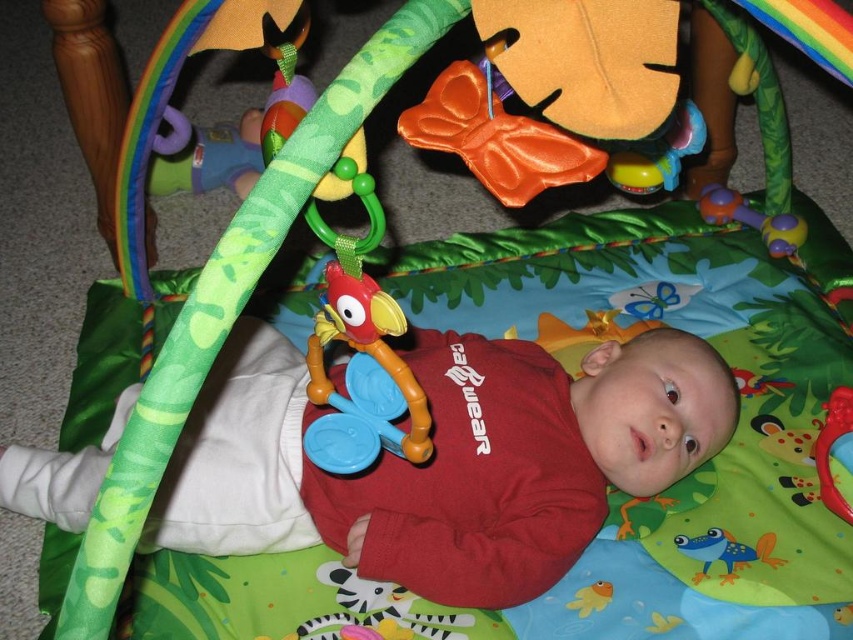
Which is more to the left, red matte baby at center or rubberized plastic bird at center?

From the viewer's perspective, red matte baby at center appears more on the left side.

Which is behind, point (537, 413) or point (322, 356)?

Positioned behind is point (537, 413).

Who is more forward, (294, 362) or (376, 368)?

Point (376, 368)

Where is `red matte baby at center`? Image resolution: width=853 pixels, height=640 pixels. red matte baby at center is located at coordinates (445, 460).

Is rubberized plastic bird at center thinner than rubberized purple rattle at upper right?

Yes.

Consider the image. Can you confirm if rubberized plastic bird at center is wider than rubberized purple rattle at upper right?

Incorrect, rubberized plastic bird at center's width does not surpass rubberized purple rattle at upper right's.

Between point (361, 298) and point (735, 211), which one is positioned behind?

The point (735, 211) is behind.

The width and height of the screenshot is (853, 640). I want to click on rubberized plastic bird at center, so click(x=363, y=376).

Is rubberized plastic bird at center taller than rubberized blue teether at upper left?

Correct, rubberized plastic bird at center is much taller as rubberized blue teether at upper left.

Between rubberized plastic bird at center and rubberized blue teether at upper left, which one has less height?

With less height is rubberized blue teether at upper left.

Who is more forward, (326, 332) or (248, 173)?

Positioned in front is point (326, 332).

Locate an element on the screen. The width and height of the screenshot is (853, 640). rubberized plastic bird at center is located at coordinates (363, 376).